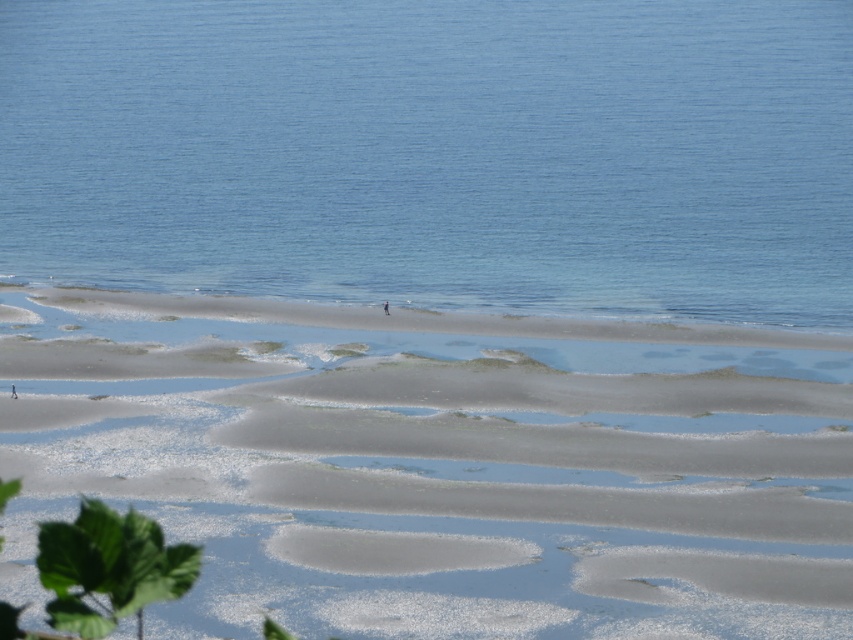
Question: From the image, what is the correct spatial relationship of clear blue water at center in relation to sandy at lower center?

Choices:
 (A) above
 (B) below

Answer: (A)

Question: Does clear blue water at center appear over sandy at lower center?

Choices:
 (A) no
 (B) yes

Answer: (B)

Question: Which point is closer to the camera taking this photo?

Choices:
 (A) click(x=657, y=372)
 (B) click(x=618, y=262)

Answer: (A)

Question: Among these points, which one is farthest from the camera?

Choices:
 (A) (376, 538)
 (B) (816, 227)

Answer: (B)

Question: Does clear blue water at center appear under sandy at lower center?

Choices:
 (A) no
 (B) yes

Answer: (A)